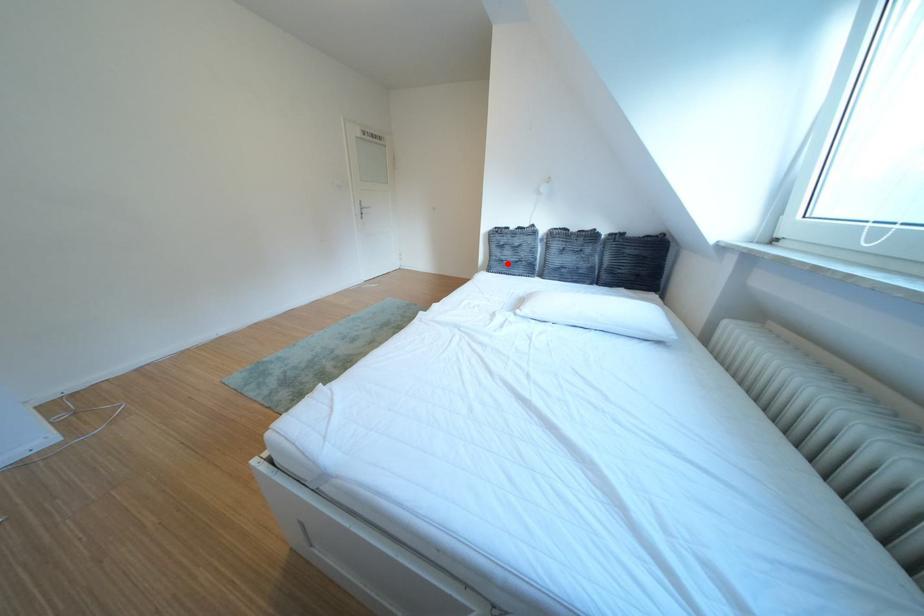
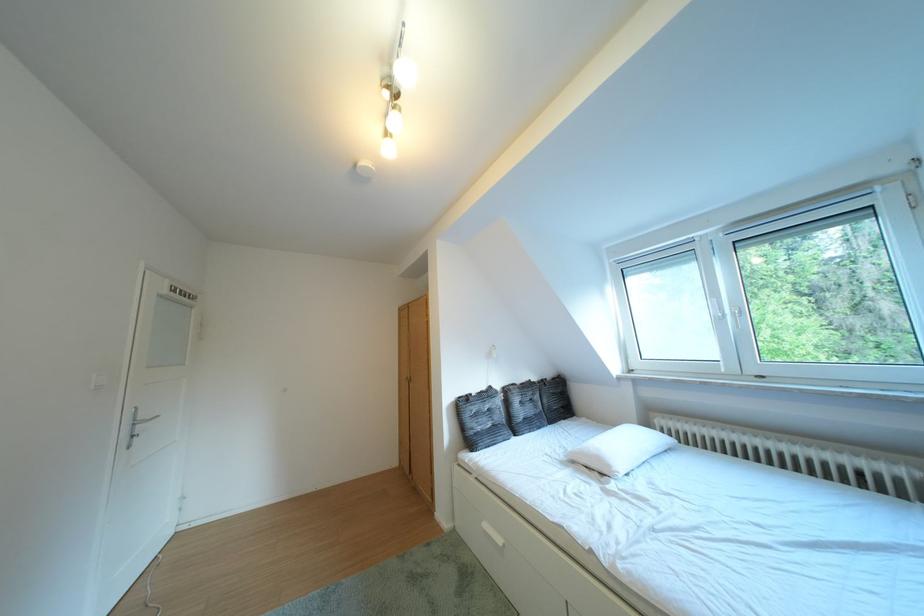
The point at the highlighted location is marked in the first image. Where is the corresponding point in the second image?

(484, 438)